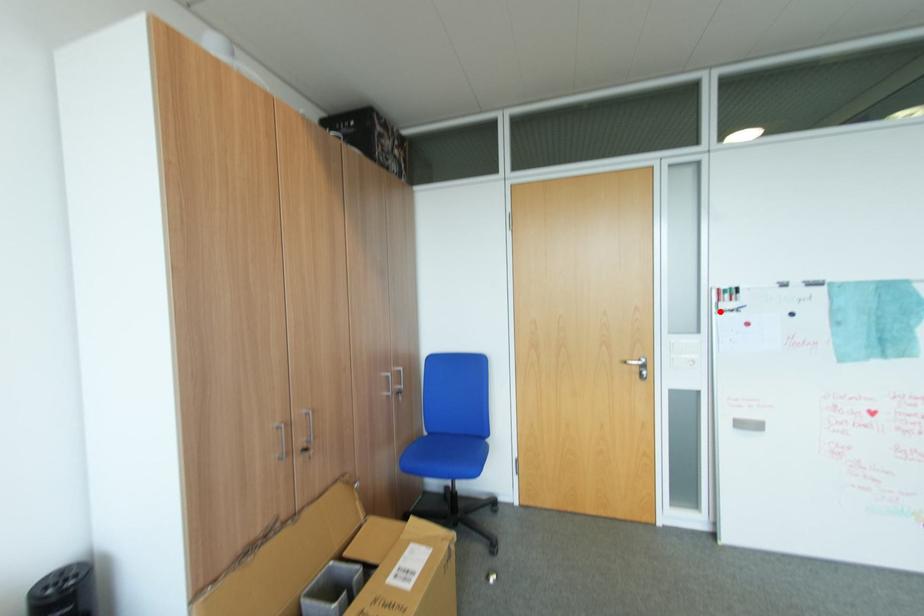
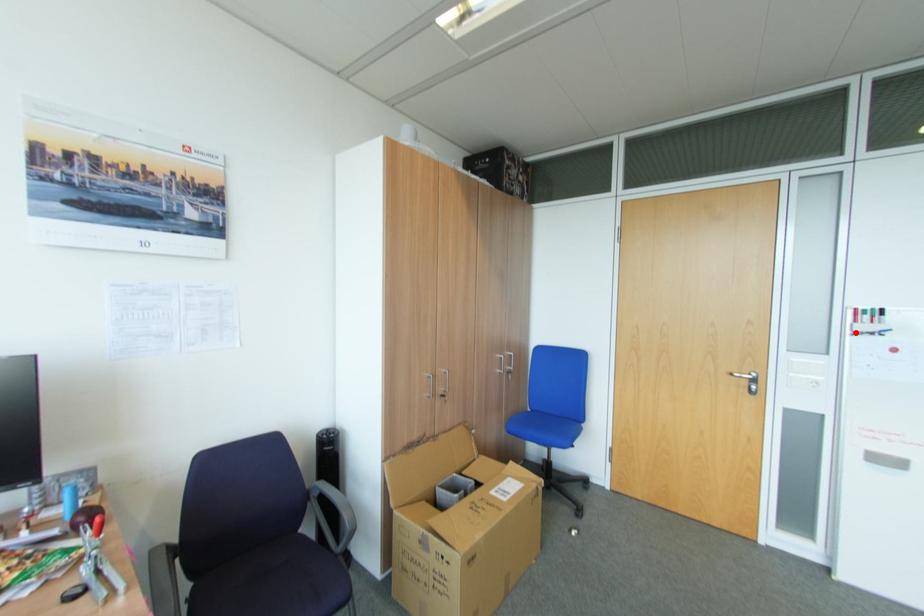
I am providing you with two images of the same scene from different viewpoints. A red point is marked on the first image and another point is marked on the second image. Is the red point in image1 aligned with the point shown in image2?

Yes